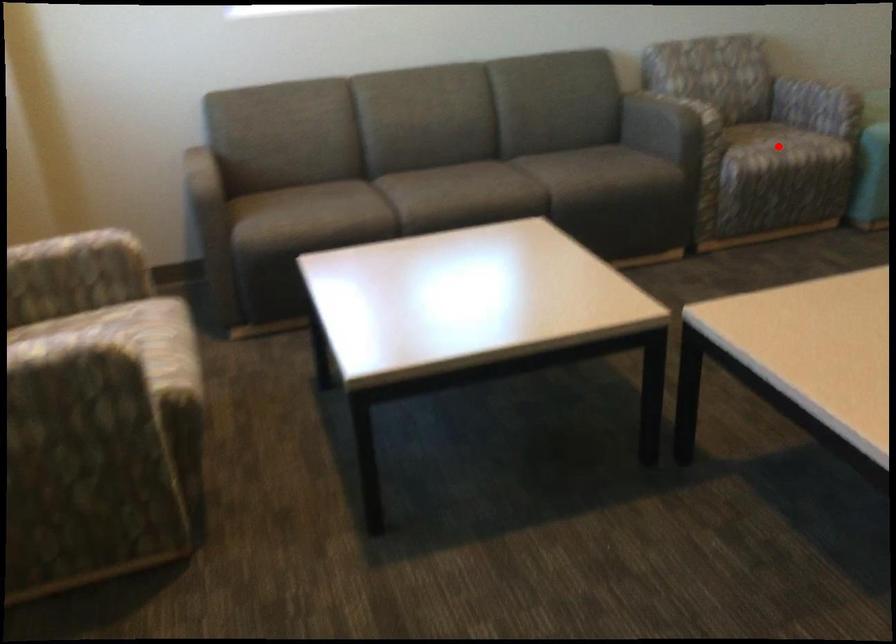
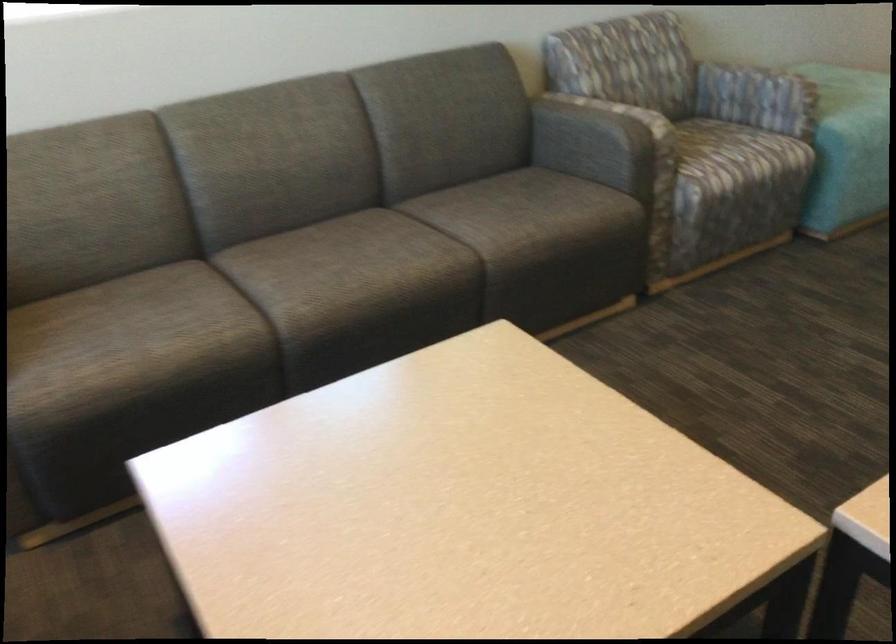
Question: I am providing you with two images of the same scene from different viewpoints. In image1, a red point is highlighted. Considering the same 3D point in image2, which of the following is correct?

Choices:
 (A) It is closer
 (B) It is farther

Answer: (A)